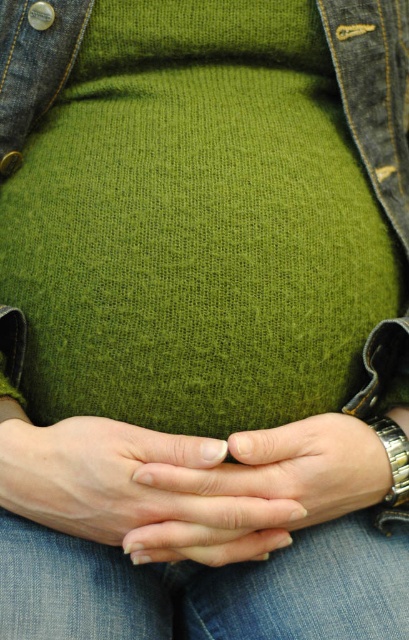
Question: Which of the following is the farthest from the observer?

Choices:
 (A) matte green sweater at center
 (B) smooth skin hands at center

Answer: (A)

Question: Can you confirm if matte green sweater at center is wider than smooth skin hands at center?

Choices:
 (A) no
 (B) yes

Answer: (B)

Question: Is blue denim jeans at lower center smaller than matte green sweater at center?

Choices:
 (A) no
 (B) yes

Answer: (A)

Question: Can you confirm if blue denim jeans at lower center is positioned to the right of smooth skin hands at center?

Choices:
 (A) no
 (B) yes

Answer: (A)

Question: Estimate the real-world distances between objects in this image. Which object is farther from the matte green sweater at center?

Choices:
 (A) blue denim jeans at lower center
 (B) smooth skin hands at center

Answer: (A)

Question: Which of the following is the closest to the observer?

Choices:
 (A) matte green sweater at center
 (B) smooth skin hands at center

Answer: (B)